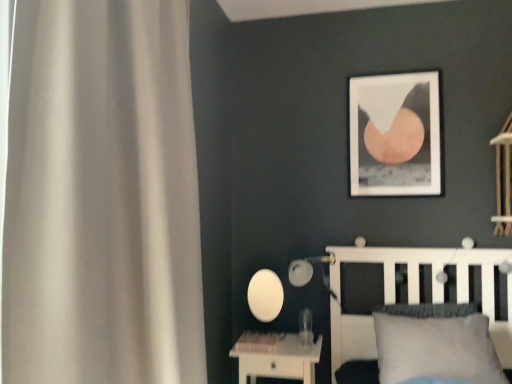
Identify the location of free point above white glossy nightstand at lower center (from a real-world perspective). This screenshot has height=384, width=512. (287, 343).